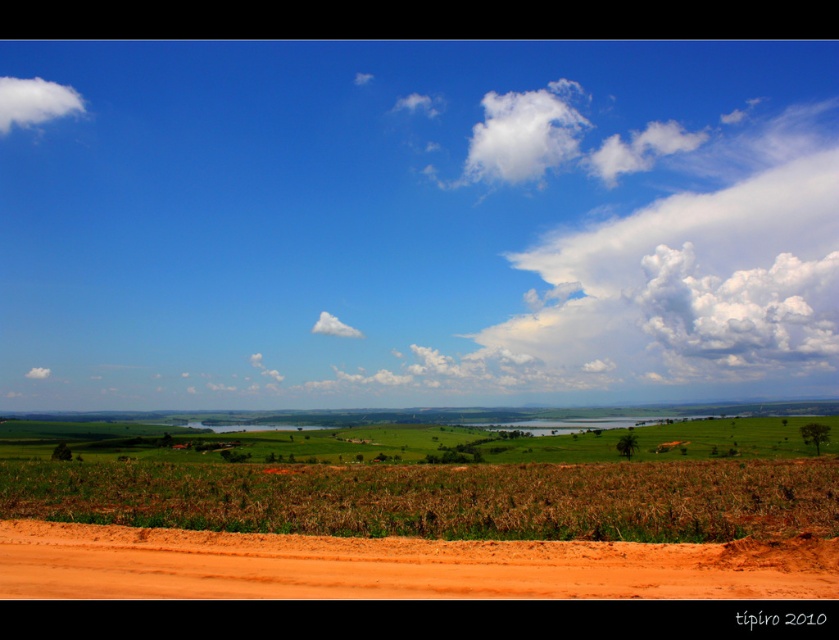
You are standing at the edge of the dirt road in the foreground and want to take a photo of the white fluffy cloud at upper left. If your camera has a maximum zoom range of 100 meters, will you be able to capture the cloud clearly?

The white fluffy cloud at upper left and camera are 200.63 meters apart from each other, which exceeds the camera maximum zoom range of 100 meters. Therefore, you won not be able to capture the cloud clearly.

You are a hot air balloon pilot preparing to land your balloon. You need to avoid the clouds to prevent turbulence. The white fluffy cloud at upper left and the white fluffy cloud at center are both in your flight path. What is the minimum distance you must maintain between your balloon and each cloud to ensure safe passage?

The white fluffy cloud at upper left and white fluffy cloud at center are 114.25 meters apart from each other. To ensure safe passage, the balloon should maintain a minimum distance of at least half the distance between the clouds, which would be 57.125 meters from each cloud.